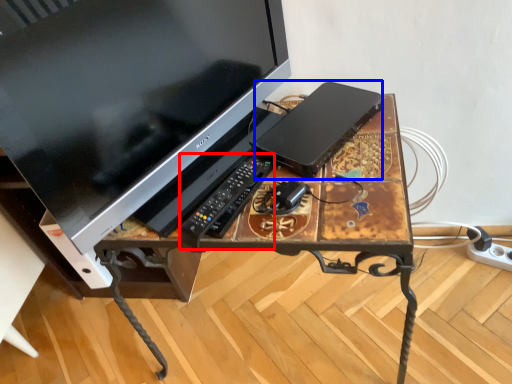
Question: Which object appears farthest to the camera in this image, control (highlighted by a red box) or computer (highlighted by a blue box)?

Choices:
 (A) control
 (B) computer

Answer: (B)